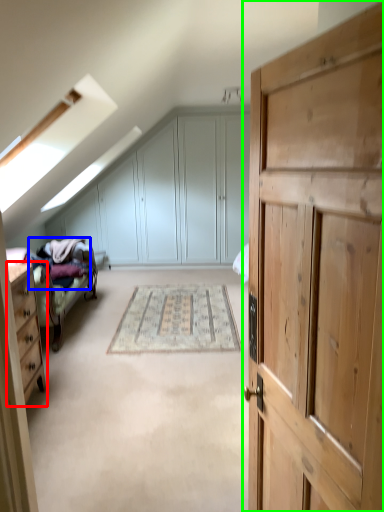
Question: Considering the real-world distances, which object is closest to chest of drawers (highlighted by a red box)? bedding (highlighted by a blue box) or cupboard (highlighted by a green box).

Choices:
 (A) bedding
 (B) cupboard

Answer: (A)